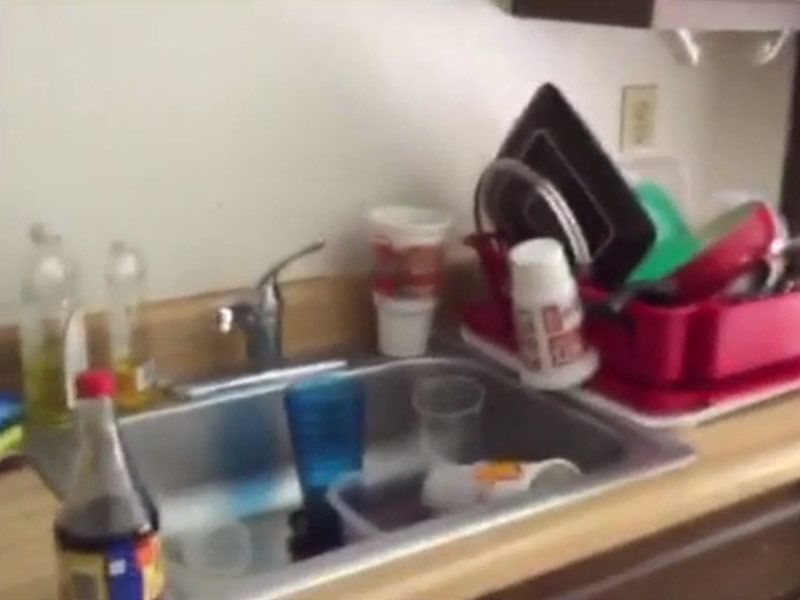
Identify the location of metal sink. (234, 451).